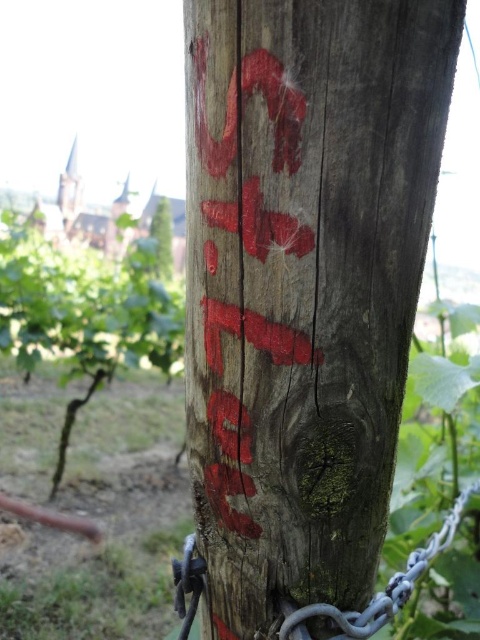
Between point (453, 22) and point (29, 300), which one is positioned in front?

Positioned in front is point (453, 22).

Can you confirm if wooden post at center is shorter than smooth brown tree trunk at center?

Yes.

Find the location of a particular element. The image size is (480, 640). wooden post at center is located at coordinates (303, 284).

Is smooth brown tree trunk at center positioned behind gray metallic chain at lower center?

Yes, smooth brown tree trunk at center is further from the viewer.

Can you confirm if smooth brown tree trunk at center is taller than gray metallic chain at lower center?

Yes.

Which is behind, point (57, 321) or point (321, 609)?

Point (57, 321)

At what (x,y) coordinates should I click in order to perform the action: click on smooth brown tree trunk at center. Please return your answer as a coordinate pair (x, y). This screenshot has height=640, width=480. Looking at the image, I should click on (84, 314).

Is smooth brown tree trunk at center above green rough wood at center?

No.

Between point (130, 328) and point (160, 220), which one is positioned in front?

Point (130, 328) is more forward.

Identify the location of smooth brown tree trunk at center. Image resolution: width=480 pixels, height=640 pixels. (84, 314).

The width and height of the screenshot is (480, 640). Identify the location of smooth brown tree trunk at center. (84, 314).